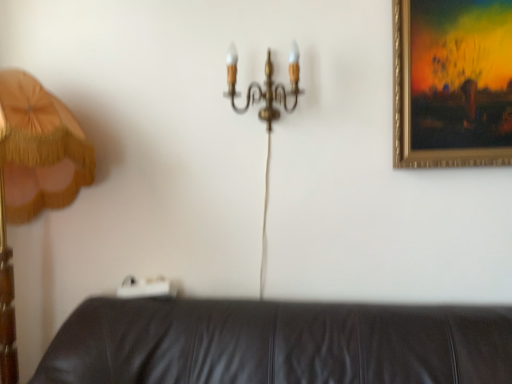
Question: Should I look upward or downward to see gold metallic chandelier at upper center?

Choices:
 (A) up
 (B) down

Answer: (A)

Question: Is the position of wooden lampshade at left more distant than that of gold metallic chandelier at upper center?

Choices:
 (A) yes
 (B) no

Answer: (B)

Question: Considering the relative positions of wooden lampshade at left and gold metallic chandelier at upper center in the image provided, is wooden lampshade at left to the left of gold metallic chandelier at upper center from the viewer's perspective?

Choices:
 (A) no
 (B) yes

Answer: (B)

Question: Does wooden lampshade at left turn towards gold metallic chandelier at upper center?

Choices:
 (A) yes
 (B) no

Answer: (B)

Question: Is gold metallic chandelier at upper center at the back of wooden lampshade at left?

Choices:
 (A) no
 (B) yes

Answer: (A)

Question: Is wooden lampshade at left in contact with gold metallic chandelier at upper center?

Choices:
 (A) no
 (B) yes

Answer: (A)

Question: Is wooden lampshade at left smaller than gold metallic chandelier at upper center?

Choices:
 (A) yes
 (B) no

Answer: (B)

Question: Can you confirm if gold metallic chandelier at upper center is positioned to the left of wooden lampshade at left?

Choices:
 (A) no
 (B) yes

Answer: (A)

Question: Is gold metallic chandelier at upper center facing towards wooden lampshade at left?

Choices:
 (A) yes
 (B) no

Answer: (B)

Question: Would you say gold metallic chandelier at upper center is outside wooden lampshade at left?

Choices:
 (A) no
 (B) yes

Answer: (B)

Question: Is gold metallic chandelier at upper center positioned with its back to wooden lampshade at left?

Choices:
 (A) no
 (B) yes

Answer: (A)

Question: Considering the relative sizes of gold metallic chandelier at upper center and wooden lampshade at left in the image provided, is gold metallic chandelier at upper center bigger than wooden lampshade at left?

Choices:
 (A) no
 (B) yes

Answer: (A)

Question: From a real-world perspective, is gold metallic chandelier at upper center on wooden lampshade at left?

Choices:
 (A) no
 (B) yes

Answer: (B)

Question: Is gold-framed painting at upper right behind wooden lampshade at left?

Choices:
 (A) yes
 (B) no

Answer: (A)